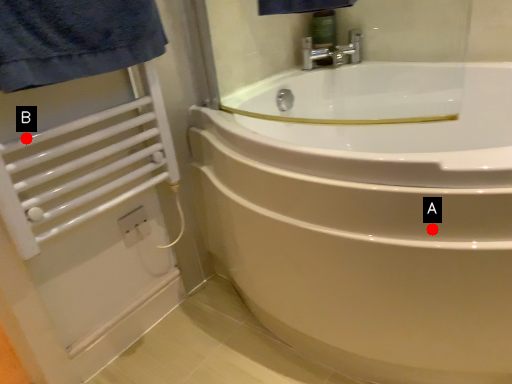
Question: Two points are circled on the image, labeled by A and B beside each circle. Which point is farther to the camera?

Choices:
 (A) A is further
 (B) B is further

Answer: (B)